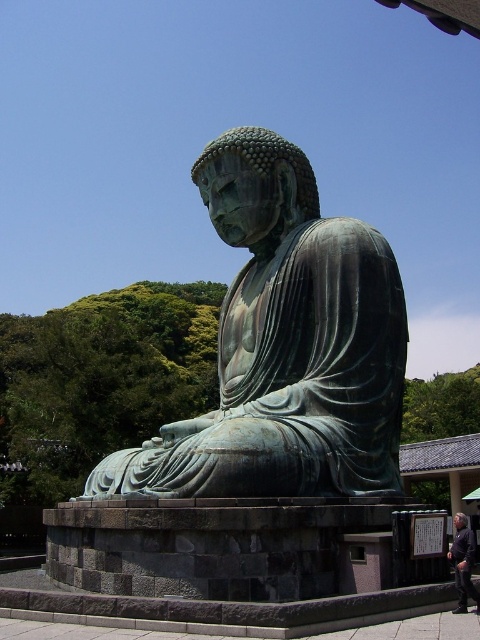
Question: Is green patina statue at center above dark purple fabric at lower right?

Choices:
 (A) no
 (B) yes

Answer: (B)

Question: Which of the following is the closest to the observer?

Choices:
 (A) (220, 161)
 (B) (456, 529)

Answer: (B)

Question: Which point is farther from the camera taking this photo?

Choices:
 (A) (459, 513)
 (B) (331, 298)

Answer: (A)

Question: Is green patina statue at center positioned behind dark purple fabric at lower right?

Choices:
 (A) yes
 (B) no

Answer: (A)

Question: Can you confirm if green patina statue at center is smaller than dark purple fabric at lower right?

Choices:
 (A) yes
 (B) no

Answer: (A)